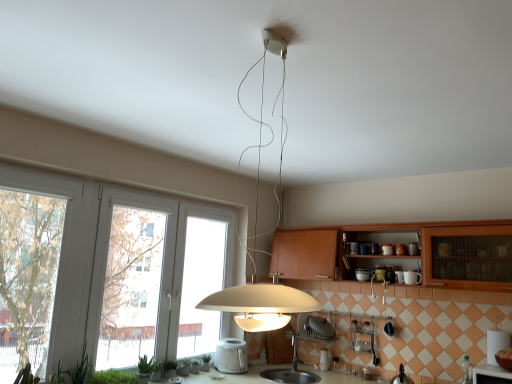
At what (x,y) coordinates should I click in order to perform the action: click on free point above matte white pendant light at center (from a real-world perspective). Please return your answer as a coordinate pair (x, y). Looking at the image, I should click on (274, 31).